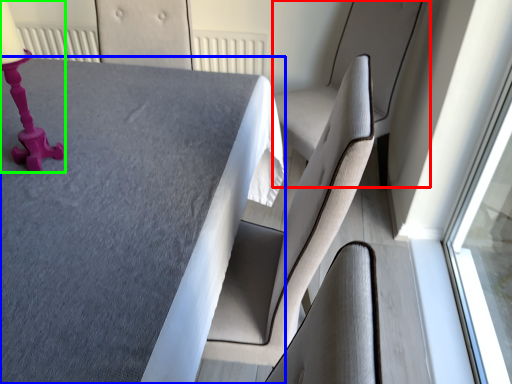
Question: Based on their relative distances, which object is farther from swivel chair (highlighted by a red box)? Choose from table (highlighted by a blue box) and table lamp (highlighted by a green box).

Choices:
 (A) table
 (B) table lamp

Answer: (B)